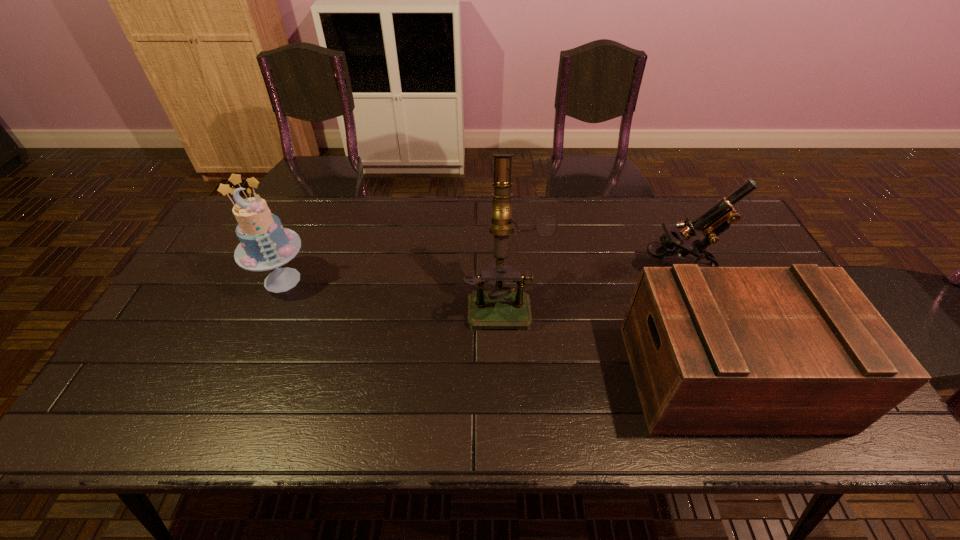
Where is `vacant area that lies between the right microscope and the tallest object`? The height and width of the screenshot is (540, 960). vacant area that lies between the right microscope and the tallest object is located at coordinates (591, 285).

Where is `free area in between the tallest object and the shorter microscope`? This screenshot has height=540, width=960. free area in between the tallest object and the shorter microscope is located at coordinates (591, 285).

Where is `free area in between the shorter microscope and the second object from left to right`? This screenshot has height=540, width=960. free area in between the shorter microscope and the second object from left to right is located at coordinates pos(591,285).

This screenshot has height=540, width=960. In order to click on free space between the right microscope and the tallest object in this screenshot , I will do `click(591, 285)`.

This screenshot has height=540, width=960. I want to click on free area in between the right microscope and the third object from right to left, so click(591, 285).

Choose which object is the nearest neighbor to the tallest object. Please provide its 2D coordinates. Your answer should be formatted as a tuple, i.e. [(x, y)], where the tuple contains the x and y coordinates of a point satisfying the conditions above.

[(714, 350)]

The width and height of the screenshot is (960, 540). What are the coordinates of `the third closest object to the leftmost object` in the screenshot? It's located at (717, 219).

Where is `free region that satisfies the following two spatial constraints: 1. at the eyepiece of the box; 2. on the left side of the left microscope`? The width and height of the screenshot is (960, 540). free region that satisfies the following two spatial constraints: 1. at the eyepiece of the box; 2. on the left side of the left microscope is located at coordinates (509, 376).

Locate an element on the screen. free location that satisfies the following two spatial constraints: 1. through the eyepiece of the right microscope; 2. at the eyepiece of the left microscope is located at coordinates (691, 300).

Where is `free space that satisfies the following two spatial constraints: 1. through the eyepiece of the shorter microscope; 2. at the eyepiece of the left microscope`? This screenshot has height=540, width=960. free space that satisfies the following two spatial constraints: 1. through the eyepiece of the shorter microscope; 2. at the eyepiece of the left microscope is located at coordinates (691, 300).